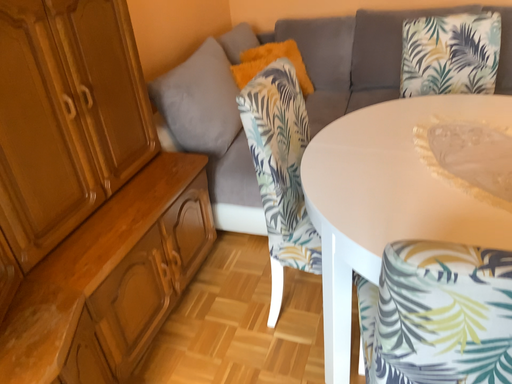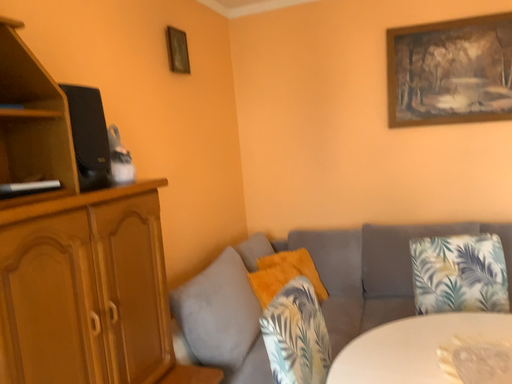
Question: Which way did the camera rotate in the video?

Choices:
 (A) rotated upward
 (B) rotated downward

Answer: (A)